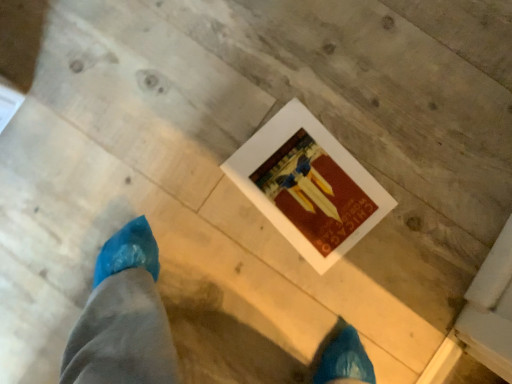
The width and height of the screenshot is (512, 384). Describe the element at coordinates (308, 186) in the screenshot. I see `matte paper postcard at center` at that location.

Locate an element on the screen. Image resolution: width=512 pixels, height=384 pixels. matte paper postcard at center is located at coordinates (308, 186).

Find the location of `matte paper postcard at center`. matte paper postcard at center is located at coordinates (308, 186).